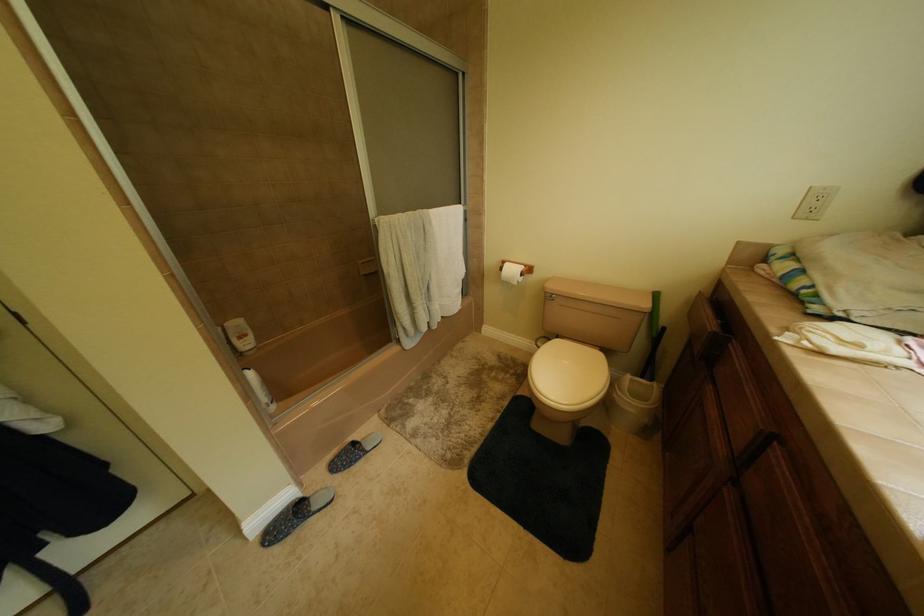
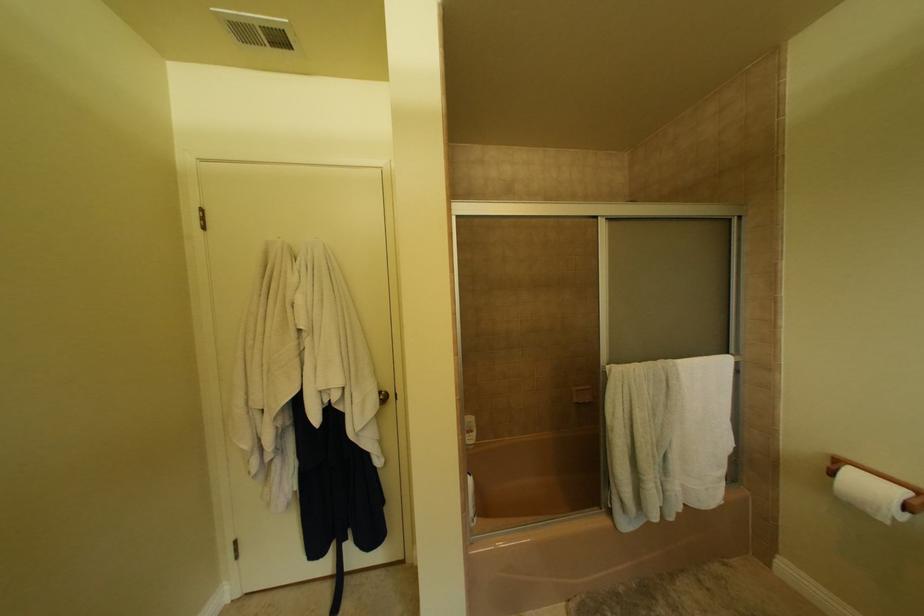
The images are taken continuously from a first-person perspective. In which direction is your viewpoint rotating?

The camera's rotation is toward left-up.